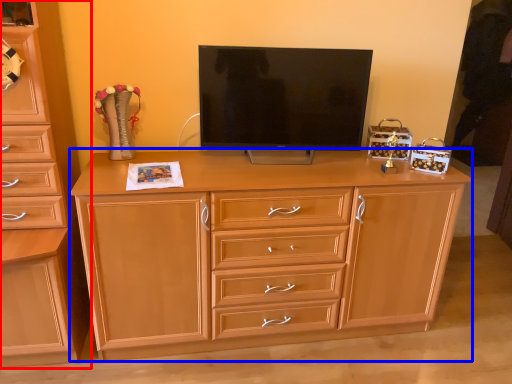
Question: Which of the following is the closest to the observer, chest of drawers (highlighted by a red box) or chest of drawers (highlighted by a blue box)?

Choices:
 (A) chest of drawers
 (B) chest of drawers

Answer: (A)